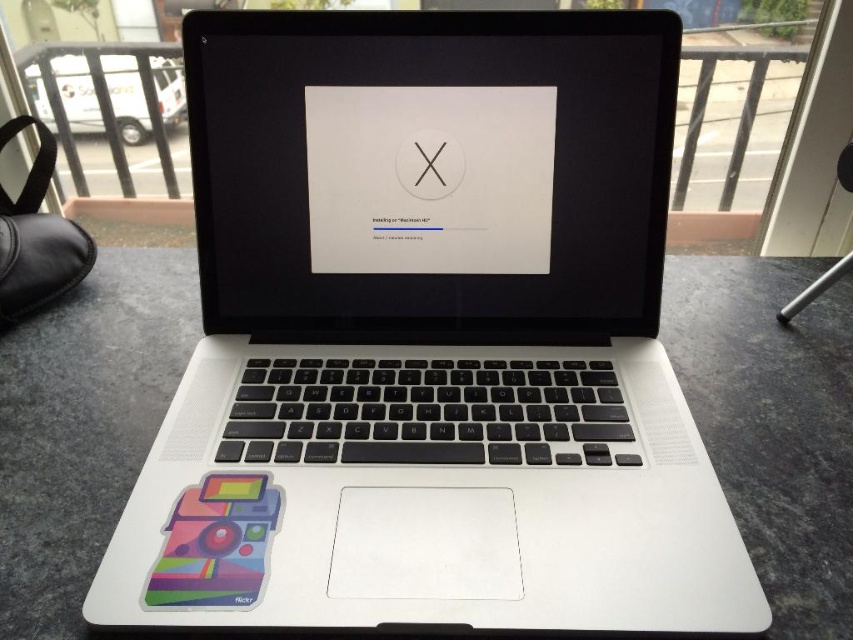
Consider the image. Can you confirm if multicolored glossy sticker at lower left is taller than black matte logo at center?

Correct, multicolored glossy sticker at lower left is much taller as black matte logo at center.

Is multicolored glossy sticker at lower left wider than black matte logo at center?

Indeed, multicolored glossy sticker at lower left has a greater width compared to black matte logo at center.

Is point (253, 497) closer to camera compared to point (454, 173)?

That is True.

What are the coordinates of `multicolored glossy sticker at lower left` in the screenshot? It's located at (216, 544).

Based on the photo, measure the distance from satin black screen at center to black matte logo at center.

A distance of 4.60 inches exists between satin black screen at center and black matte logo at center.

Is satin black screen at center in front of black matte logo at center?

Yes, it is.

Locate an element on the screen. The image size is (853, 640). satin black screen at center is located at coordinates (430, 90).

The height and width of the screenshot is (640, 853). I want to click on satin black screen at center, so click(430, 90).

Does satin black screen at center have a lesser width compared to multicolored glossy sticker at lower left?

No.

Locate an element on the screen. This screenshot has height=640, width=853. satin black screen at center is located at coordinates [430, 90].